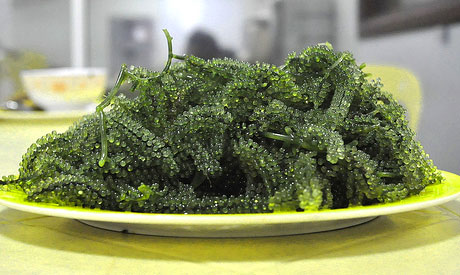
Identify the location of white bowl in the background. (66, 86).